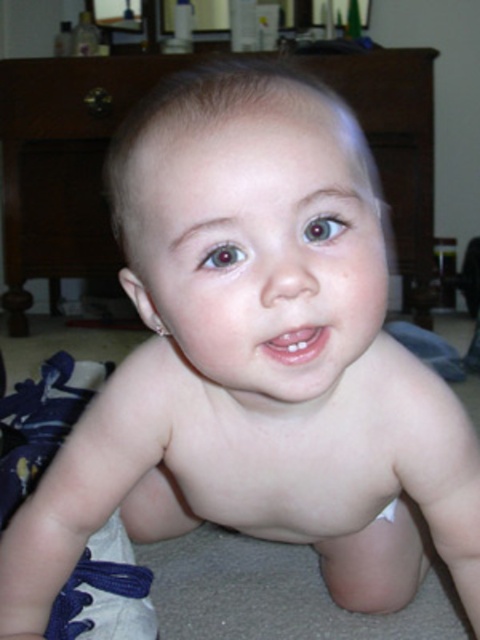
You are a photographer setting up a shoot in this room. You need to place a small toy between the brown wood dresser at upper center and the white cloth diaper at lower center. Where should you position the toy so that it is closer to the larger object?

The brown wood dresser at upper center is larger than the white cloth diaper at lower center. Therefore, the toy should be positioned closer to the brown wood dresser at upper center to satisfy the requirement.

You are a parent trying to put on your child. You see the blue fabric shoe at lower left and the white cloth diaper at lower center. Which item is taller?

The blue fabric shoe at lower left is taller than the white cloth diaper at lower center.

You are a parent who wants to place a new toy on the brown wood dresser at upper center. Considering the height of the white cloth diaper at lower center, will the toy be visible from the child sitting at lower center?

The brown wood dresser at upper center is taller than the white cloth diaper at lower center, so the toy placed on the brown wood dresser at upper center will be visible above the white cloth diaper at lower center from the child sitting at lower center.